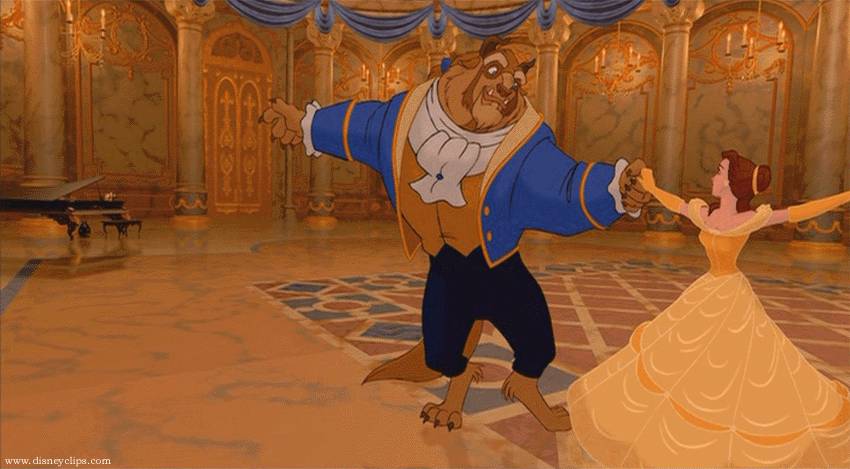
This screenshot has width=850, height=469. I want to click on marble pillars, so click(x=46, y=97), click(x=196, y=95), click(x=320, y=78), click(x=551, y=89), click(x=672, y=110), click(x=826, y=121).